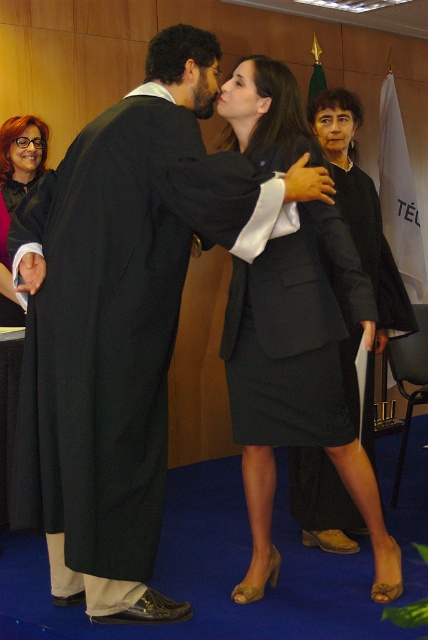
Consider the image. You are a photographer at the graduation ceremony. You need to position a spotlight exactly at point [294,333]. Which object should you focus the spotlight on?

The spotlight should be focused on the black matte suit at center, as it is located at point [294,333].

You are a photographer at this graduation ceremony. You need to capture a photo where both the matte black suit at center and the matte black gown at left are visible. Which object should you focus on first to ensure both are in frame?

You should focus on the matte black gown at left first because it is smaller than the matte black suit at center, so positioning the camera to include the larger object first will ensure the smaller one is also captured.